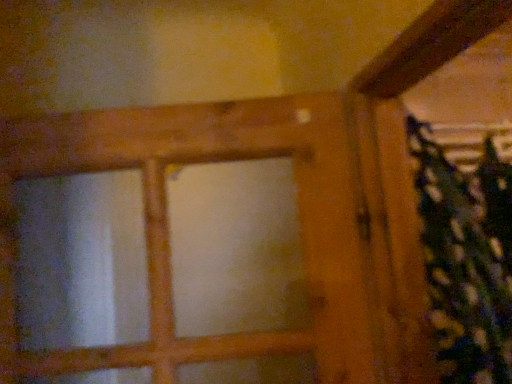
In order to click on green matte garland at right in this screenshot , I will do `click(459, 262)`.

Describe the element at coordinates (459, 262) in the screenshot. I see `green matte garland at right` at that location.

At what (x,y) coordinates should I click in order to perform the action: click on green matte garland at right. Please return your answer as a coordinate pair (x, y). This screenshot has height=384, width=512. Looking at the image, I should click on (459, 262).